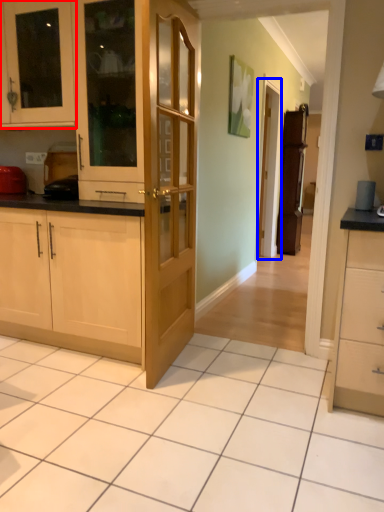
Question: Which object appears closest to the camera in this image, cabinetry (highlighted by a red box) or screen door (highlighted by a blue box)?

Choices:
 (A) cabinetry
 (B) screen door

Answer: (A)